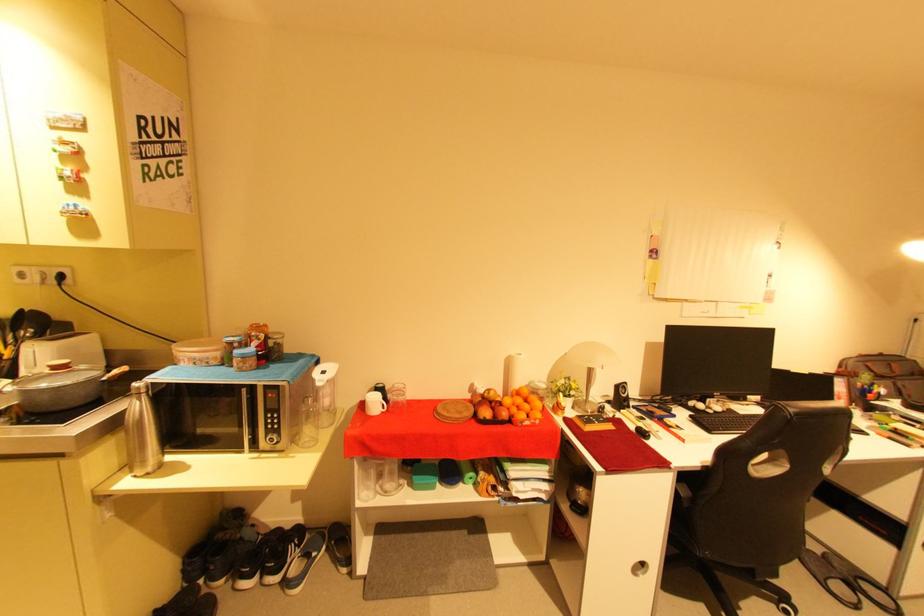
Image resolution: width=924 pixels, height=616 pixels. Find the location of `computer mouse`. computer mouse is located at coordinates (641, 432).